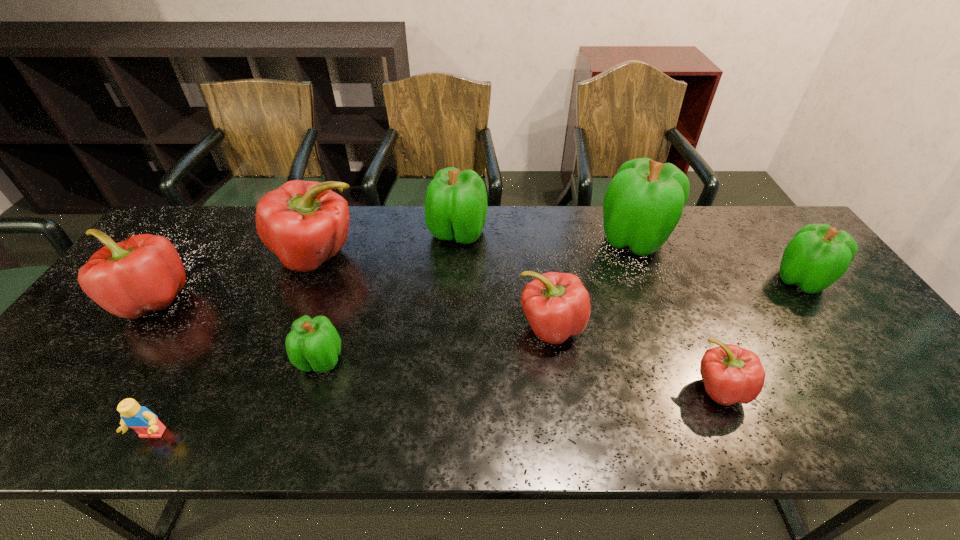
At what (x,y) coordinates should I click in order to perform the action: click on vacant space at the right edge. Please return your answer as a coordinate pair (x, y). The width and height of the screenshot is (960, 540). Looking at the image, I should click on (807, 294).

Locate an element on the screen. Image resolution: width=960 pixels, height=540 pixels. vacant area at the near right corner is located at coordinates (884, 417).

Locate an element on the screen. The height and width of the screenshot is (540, 960). vacant area between the fifth object from left to right and the biggest pink bell pepper is located at coordinates (388, 244).

Where is `free space between the third biggest pink bell pepper and the fifth object from right to left`? This screenshot has width=960, height=540. free space between the third biggest pink bell pepper and the fifth object from right to left is located at coordinates (504, 280).

The height and width of the screenshot is (540, 960). I want to click on vacant area between the smallest green bell pepper and the fifth bell pepper from right to left, so click(x=389, y=296).

The width and height of the screenshot is (960, 540). What are the coordinates of `vacant area between the second biggest pink bell pepper and the second smallest pink bell pepper` in the screenshot? It's located at (352, 313).

This screenshot has height=540, width=960. In order to click on vacant point located between the rightmost bell pepper and the biggest green bell pepper in this screenshot , I will do `click(717, 259)`.

Identify the location of vacant space in between the fourth object from right to left and the nearest pink bell pepper. Image resolution: width=960 pixels, height=540 pixels. (636, 357).

I want to click on blank region between the leftmost bell pepper and the fourth object from right to left, so click(352, 313).

Identify the location of free space that is in between the fifth bell pepper from left to right and the nearest object. (x=351, y=381).